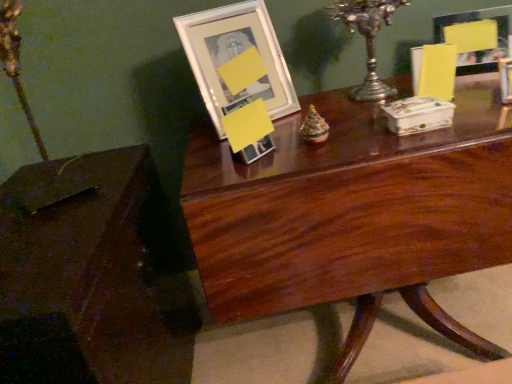
Locate an element on the screen. The height and width of the screenshot is (384, 512). vacant region above brown polished wood table at lower left, the 1th table viewed from the left (from a real-world perspective) is located at coordinates (61, 203).